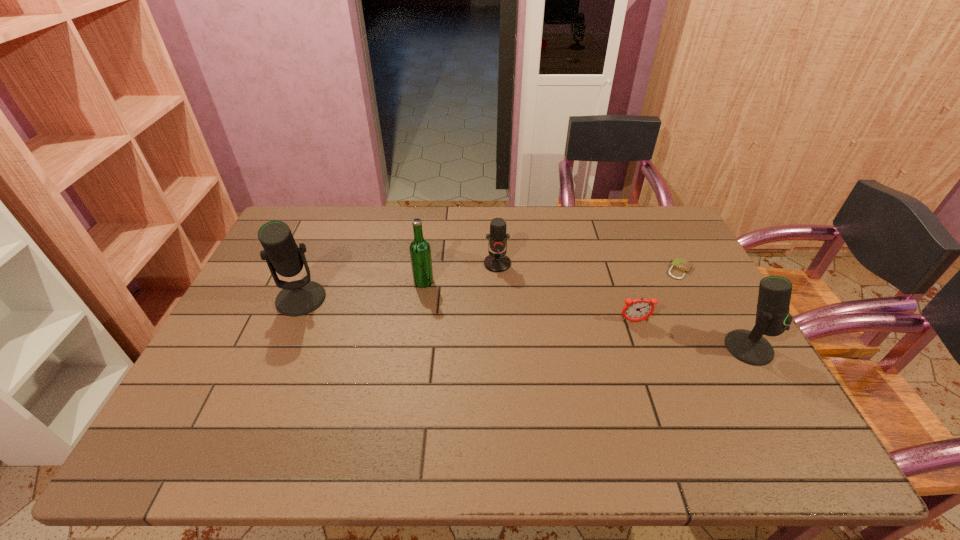
In the image, there is a desktop. Where is `vacant region at the near edge`? This screenshot has width=960, height=540. vacant region at the near edge is located at coordinates (432, 400).

Identify the location of vacant space at the right edge of the desktop. (732, 330).

In order to click on vacant area at the far left corner in this screenshot , I will do `click(313, 227)`.

Locate an element on the screen. vacant region at the far right corner of the desktop is located at coordinates (663, 215).

Identify the location of blank region between the beer bottle and the padlock. (552, 276).

Find the location of a particular element. Image resolution: width=960 pixels, height=540 pixels. free space between the tallest microphone and the padlock is located at coordinates (491, 284).

Where is `blank region between the third object from right to left and the nearest object`? The height and width of the screenshot is (540, 960). blank region between the third object from right to left and the nearest object is located at coordinates (692, 334).

Locate an element on the screen. The width and height of the screenshot is (960, 540). free spot between the shortest microphone and the beer bottle is located at coordinates (461, 273).

This screenshot has width=960, height=540. In order to click on free point between the tallest object and the rightmost microphone in this screenshot , I will do `click(525, 323)`.

Locate an element on the screen. The height and width of the screenshot is (540, 960). unoccupied area between the second microphone from right to left and the shortest object is located at coordinates (588, 267).